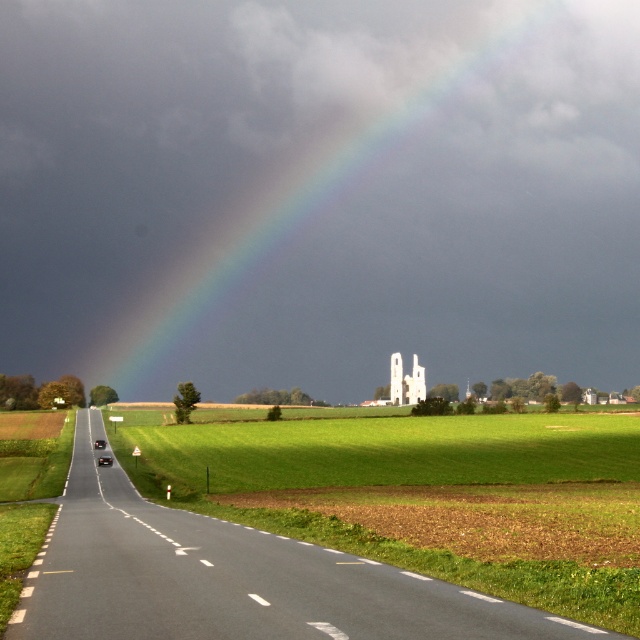
You are a photographer standing at the edge of the road in the rural landscape scene. You want to capture the rainbow at upper center in your shot. Based on its 2D coordinates, where should you position your camera to ensure the rainbow is centered in your viewfinder?

To center the rainbow at upper center in your viewfinder, position your camera so that its lens aligns with the coordinates point (323, 193), ensuring the rainbow is precisely centered.

You are driving a delivery van that is 6 meters long. You need to make a U turn on the road. There are two cars parked on the road, a black glossy car at center and a shiny black sedan at road center. Can you safely complete the U turn without hitting either car?

The black glossy car at center is 12.52 meters away from the shiny black sedan at road center. To safely make a U turn, you need at least twice the length of your vehicle, which is 12 meters. Since the distance between the two cars is 12.52 meters, which is slightly more than 12 meters, you can safely complete the U turn without hitting either car.